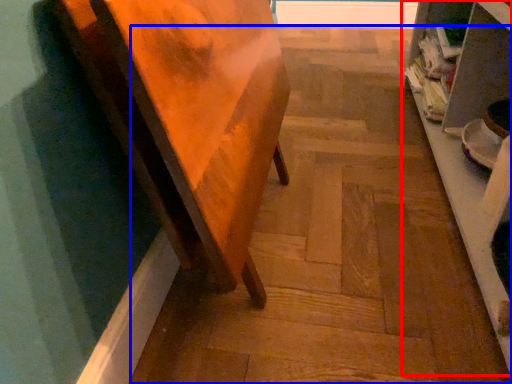
Question: Which of the following is the closest to the observer, shelf (highlighted by a red box) or stair (highlighted by a blue box)?

Choices:
 (A) shelf
 (B) stair

Answer: (A)